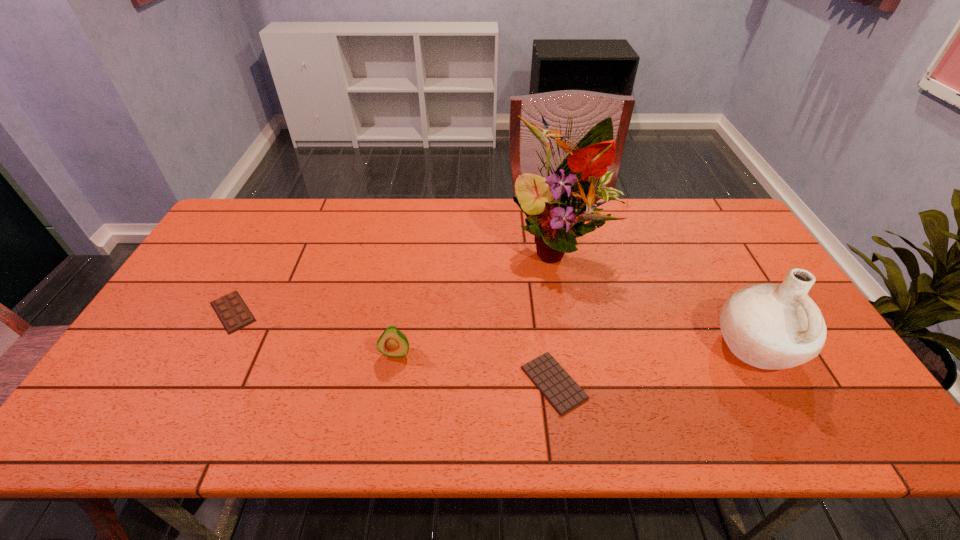
Locate an element on the screen. This screenshot has width=960, height=540. free location located 0.280m on the front-facing side of the bouquet is located at coordinates (581, 361).

The image size is (960, 540). Find the location of `blank space located to pour from the handle of the pottery`. blank space located to pour from the handle of the pottery is located at coordinates pyautogui.click(x=659, y=346).

The width and height of the screenshot is (960, 540). Identify the location of blank space located to pour from the handle of the pottery. (647, 346).

Locate an element on the screen. Image resolution: width=960 pixels, height=540 pixels. free region located 0.400m to pour from the handle of the pottery is located at coordinates (558, 346).

The width and height of the screenshot is (960, 540). What are the coordinates of `vacant space located 0.110m on the cut side of the third shortest object` in the screenshot? It's located at (388, 400).

The height and width of the screenshot is (540, 960). In order to click on free location located on the back of the left chocolate bar in this screenshot , I will do `click(271, 241)`.

Locate an element on the screen. free space located 0.110m on the left of the shortest object is located at coordinates (476, 383).

Identify the location of object positioned at the far edge. (557, 207).

Find the location of a particular element. This screenshot has height=540, width=960. object present at the near edge is located at coordinates (559, 388).

Identify the location of object that is at the left edge. This screenshot has height=540, width=960. (232, 311).